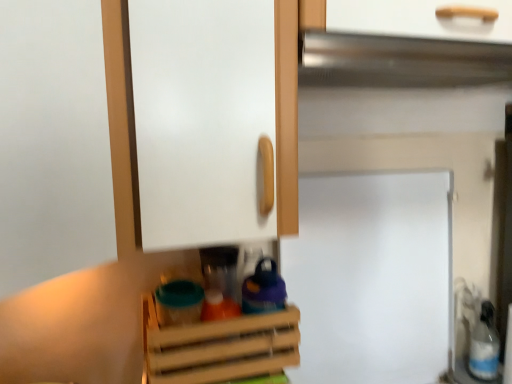
Measure the distance between white plastic bottle at lower right and camera.

white plastic bottle at lower right and camera are 3.66 feet apart from each other.

What do you see at coordinates (219, 347) in the screenshot? Image resolution: width=512 pixels, height=384 pixels. I see `wooden crate at center` at bounding box center [219, 347].

Where is `wooden crate at center`? This screenshot has height=384, width=512. wooden crate at center is located at coordinates (219, 347).

Identify the location of silver metallic exhaust hood at upper center. This screenshot has height=384, width=512. (399, 61).

Is white plastic bottle at lower right oriented towards white matte fridge at center?

No, white plastic bottle at lower right is not facing towards white matte fridge at center.

Where is `bottle on the right of the white matte fridge at center`? bottle on the right of the white matte fridge at center is located at coordinates [484, 345].

Would you say white plastic bottle at lower right is to the left or to the right of white matte fridge at center in the picture?

Clearly, white plastic bottle at lower right is on the right of white matte fridge at center in the image.

In the image, there is a silver metallic exhaust hood at upper center. At what (x,y) coordinates should I click in order to perform the action: click on bottle below it (from the image's perspective). Please return your answer as a coordinate pair (x, y). The image size is (512, 384). Looking at the image, I should click on (484, 345).

Is silver metallic exhaust hood at upper center in contact with white plastic bottle at lower right?

No, silver metallic exhaust hood at upper center is not touching white plastic bottle at lower right.

Is silver metallic exhaust hood at upper center spatially inside white plastic bottle at lower right, or outside of it?

silver metallic exhaust hood at upper center exists outside the volume of white plastic bottle at lower right.

From a real-world perspective, who is located higher, white plastic bottle at lower right or wooden crate at center?

wooden crate at center is physically above.

From the image's perspective, which object appears higher, white plastic bottle at lower right or wooden crate at center?

wooden crate at center is shown above in the image.

Which object is thinner, white plastic bottle at lower right or wooden crate at center?

Thinner between the two is white plastic bottle at lower right.

Is point (493, 325) in front of point (176, 338)?

No.

Is wooden crate at center facing towards white plastic bottle at lower right?

No, wooden crate at center does not turn towards white plastic bottle at lower right.

Which object is closer to the camera taking this photo, wooden crate at center or white plastic bottle at lower right?

wooden crate at center is more forward.

Who is bigger, wooden crate at center or white plastic bottle at lower right?

wooden crate at center.

Does wooden crate at center have a greater width compared to white plastic bottle at lower right?

Yes, wooden crate at center is wider than white plastic bottle at lower right.

How far apart are silver metallic exhaust hood at upper center and wooden crate at center?

silver metallic exhaust hood at upper center is 20.81 inches from wooden crate at center.

Can you confirm if silver metallic exhaust hood at upper center is bigger than wooden crate at center?

Yes.

Is point (489, 56) positioned after point (154, 322)?

No, it is in front of (154, 322).

Is silver metallic exhaust hood at upper center oriented towards wooden crate at center?

No, silver metallic exhaust hood at upper center is not aimed at wooden crate at center.

Is wooden crate at center touching white matte fridge at center?

They are not placed beside each other.

Does wooden crate at center have a lesser height compared to white matte fridge at center?

Yes.

Is wooden crate at center oriented away from white matte fridge at center?

No, wooden crate at center is not facing the opposite direction of white matte fridge at center.

Is point (226, 370) farther from camera compared to point (411, 316)?

No, it is not.

Is wooden crate at center in contact with silver metallic exhaust hood at upper center?

They are not placed beside each other.

From the image's perspective, is wooden crate at center located above silver metallic exhaust hood at upper center?

Incorrect, from the image's perspective, wooden crate at center is lower than silver metallic exhaust hood at upper center.

Could you tell me if wooden crate at center is facing silver metallic exhaust hood at upper center?

No, wooden crate at center is not aimed at silver metallic exhaust hood at upper center.

This screenshot has width=512, height=384. I want to click on bottle behind the white matte fridge at center, so click(484, 345).

At what (x,y) coordinates should I click in order to perform the action: click on exhaust hood that appears above the white plastic bottle at lower right (from a real-world perspective). Please return your answer as a coordinate pair (x, y). Looking at the image, I should click on (399, 61).

When comparing their distances from silver metallic exhaust hood at upper center, does wooden crate at center or white plastic bottle at lower right seem further?

Among the two, white plastic bottle at lower right is located further to silver metallic exhaust hood at upper center.

Considering their positions, is white matte fridge at center positioned further to silver metallic exhaust hood at upper center than white plastic bottle at lower right?

white plastic bottle at lower right lies further to silver metallic exhaust hood at upper center than the other object.

Looking at the image, which one is located further to wooden crate at center, white plastic bottle at lower right or white matte fridge at center?

white plastic bottle at lower right.

Looking at the image, which one is located further to white plastic bottle at lower right, wooden crate at center or white matte fridge at center?

wooden crate at center is further to white plastic bottle at lower right.

Looking at the image, which one is located closer to white matte fridge at center, white plastic bottle at lower right or silver metallic exhaust hood at upper center?

white plastic bottle at lower right is closer to white matte fridge at center.

Based on their spatial positions, is white matte fridge at center or wooden crate at center closer to white plastic bottle at lower right?

white matte fridge at center.

From the image, which object appears to be nearer to white plastic bottle at lower right, wooden crate at center or silver metallic exhaust hood at upper center?

wooden crate at center.

Considering their positions, is white matte fridge at center positioned closer to white plastic bottle at lower right than silver metallic exhaust hood at upper center?

Among the two, white matte fridge at center is located nearer to white plastic bottle at lower right.

The width and height of the screenshot is (512, 384). I want to click on fridge between silver metallic exhaust hood at upper center and white plastic bottle at lower right from top to bottom, so [x=371, y=277].

Image resolution: width=512 pixels, height=384 pixels. I want to click on fridge between silver metallic exhaust hood at upper center and wooden crate at center in the up-down direction, so click(x=371, y=277).

Find the location of a particular element. This screenshot has width=512, height=384. cabinetry that lies between silver metallic exhaust hood at upper center and white plastic bottle at lower right from top to bottom is located at coordinates (219, 347).

In order to click on fridge between wooden crate at center and white plastic bottle at lower right from left to right in this screenshot , I will do `click(371, 277)`.